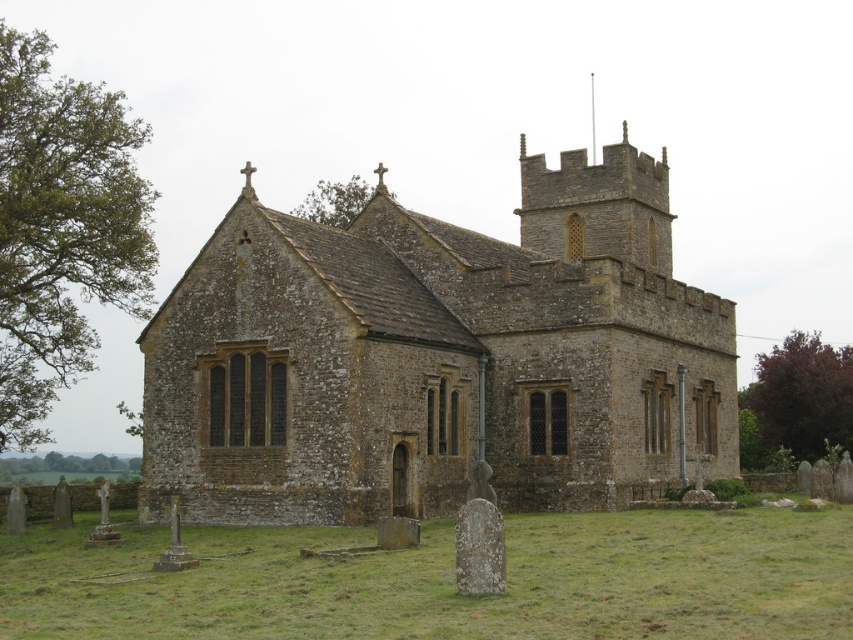
You are standing in front of the traditional stone church and notice two points marked on the building. The first point is at coordinates point (444, 381) and the second is at point (809, 348). Which of these two points is closer to your current position?

Point (444, 381) is closer to the camera than point (809, 348), so the first point is closer to your current position.

From the picture: You are a photographer planning to capture the brown stone church at center and the purple leafy tree at right in a single wide shot. Given that the camera can only focus on one subject clearly, which subject should you prioritize to ensure it fills the frame appropriately?

The brown stone church at center should be prioritized because it is larger in size than the purple leafy tree at right, making it more suitable to fill the frame appropriately.

In the scene shown: You are standing in a field looking at the brown stone church at center and the green leafy tree at upper center. From your perspective, which object is positioned to the right of the other?

The brown stone church at center is to the right of the green leafy tree at upper center.